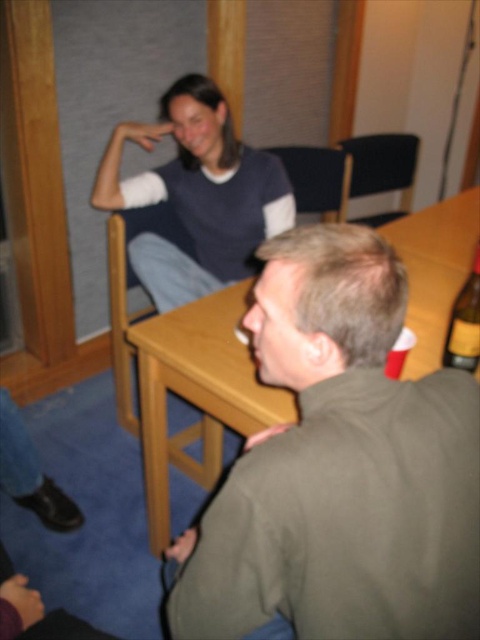
Question: Can you confirm if black plastic chair at upper center is positioned below yellow label glass bottle at table right?

Choices:
 (A) yes
 (B) no

Answer: (B)

Question: Which object appears farthest from the camera in this image?

Choices:
 (A) black fabric chair at upper center
 (B) green matte jacket at lower right
 (C) yellow label glass bottle at table right

Answer: (A)

Question: Can you confirm if wooden chair at center is thinner than yellow label glass bottle at table right?

Choices:
 (A) no
 (B) yes

Answer: (A)

Question: Is wooden chair at center closer to camera compared to black plastic chair at upper center?

Choices:
 (A) yes
 (B) no

Answer: (A)

Question: Based on their relative distances, which object is nearer to the green matte jacket at lower right?

Choices:
 (A) black fabric chair at upper center
 (B) black plastic chair at upper center

Answer: (A)

Question: Which of these objects is positioned closest to the wooden chair at center?

Choices:
 (A) black plastic chair at upper center
 (B) black fabric chair at upper center
 (C) dark blue sweater at upper left

Answer: (C)